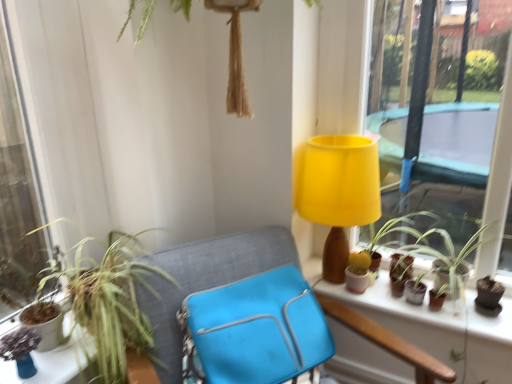
Question: From the image's perspective, is green matte plant at right, the 2th houseplant positioned from the left, on matte green plant at lower left?

Choices:
 (A) yes
 (B) no

Answer: (A)

Question: Considering the relative sizes of green matte plant at right, the 1th houseplant positioned from the right, and matte green plant at lower left in the image provided, is green matte plant at right, the 1th houseplant positioned from the right, taller than matte green plant at lower left?

Choices:
 (A) no
 (B) yes

Answer: (B)

Question: Does green matte plant at right, the 2th houseplant positioned from the left, come in front of matte green plant at lower left?

Choices:
 (A) yes
 (B) no

Answer: (B)

Question: Can you confirm if green matte plant at right, the 1th houseplant positioned from the right, is wider than matte green plant at lower left?

Choices:
 (A) yes
 (B) no

Answer: (A)

Question: Can you confirm if green matte plant at right, the 2th houseplant positioned from the left, is positioned to the left of matte green plant at lower left?

Choices:
 (A) yes
 (B) no

Answer: (B)

Question: Is green matte plant at right, the 1th houseplant positioned from the right, looking in the opposite direction of matte green plant at lower left?

Choices:
 (A) yes
 (B) no

Answer: (B)

Question: Is blue fabric bag at center far from matte brown flowerpot at right, which is the first flowerpot from right to left?

Choices:
 (A) no
 (B) yes

Answer: (A)

Question: Is blue fabric bag at center bigger than matte brown flowerpot at right, the 2th flowerpot from the left?

Choices:
 (A) yes
 (B) no

Answer: (A)

Question: Can you confirm if blue fabric bag at center is thinner than matte brown flowerpot at right, the 2th flowerpot from the left?

Choices:
 (A) no
 (B) yes

Answer: (A)

Question: Is blue fabric bag at center oriented away from matte brown flowerpot at right, the 2th flowerpot from the left?

Choices:
 (A) no
 (B) yes

Answer: (A)

Question: Is blue fabric bag at center smaller than matte brown flowerpot at right, which is the first flowerpot from right to left?

Choices:
 (A) yes
 (B) no

Answer: (B)

Question: Does blue fabric bag at center appear on the right side of matte brown flowerpot at right, the 2th flowerpot from the left?

Choices:
 (A) no
 (B) yes

Answer: (A)

Question: From the image's perspective, is matte green plant at lower left over blue fabric bag at center?

Choices:
 (A) no
 (B) yes

Answer: (B)